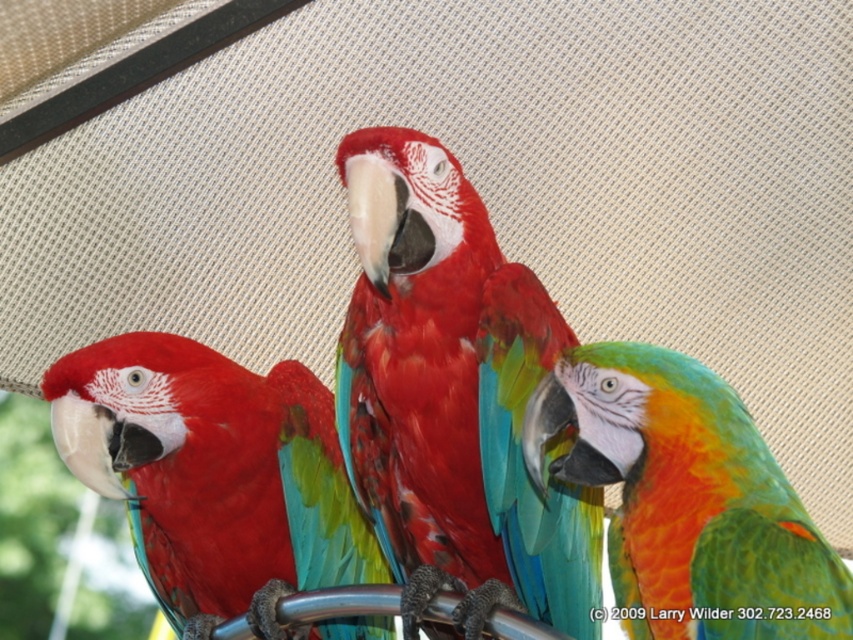
Is point (433, 208) positioned after point (675, 419)?

Yes, point (433, 208) is behind point (675, 419).

Can you confirm if shiny red parrot at center is positioned above multicolored feathered parrot at center?

Indeed, shiny red parrot at center is positioned over multicolored feathered parrot at center.

Locate an element on the screen. The width and height of the screenshot is (853, 640). shiny red parrot at center is located at coordinates (451, 397).

Identify the location of shiny red parrot at center. The image size is (853, 640). (451, 397).

Who is positioned more to the right, shiny red parrot at center or matte red parrot at left?

shiny red parrot at center

The image size is (853, 640). I want to click on shiny red parrot at center, so click(x=451, y=397).

Is point (311, 461) less distant than point (664, 358)?

That is False.

Where is `matte red parrot at left`? The height and width of the screenshot is (640, 853). matte red parrot at left is located at coordinates (212, 474).

Describe the element at coordinates (212, 474) in the screenshot. The height and width of the screenshot is (640, 853). I see `matte red parrot at left` at that location.

You are a GUI agent. You are given a task and a screenshot of the screen. Output one action in this format:
    pyautogui.click(x=<x>, y=<y>)
    Task: Click on the matte red parrot at left
    
    Given the screenshot: What is the action you would take?
    pyautogui.click(x=212, y=474)